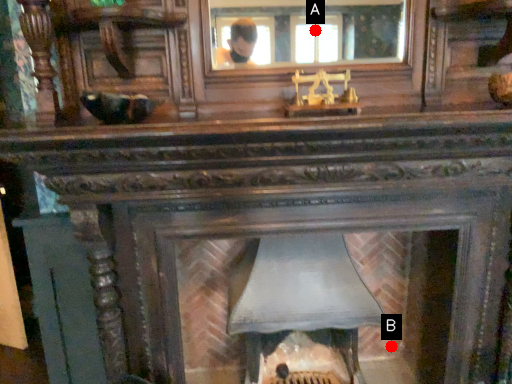
Question: Two points are circled on the image, labeled by A and B beside each circle. Which point appears closest to the camera in this image?

Choices:
 (A) A is closer
 (B) B is closer

Answer: (B)